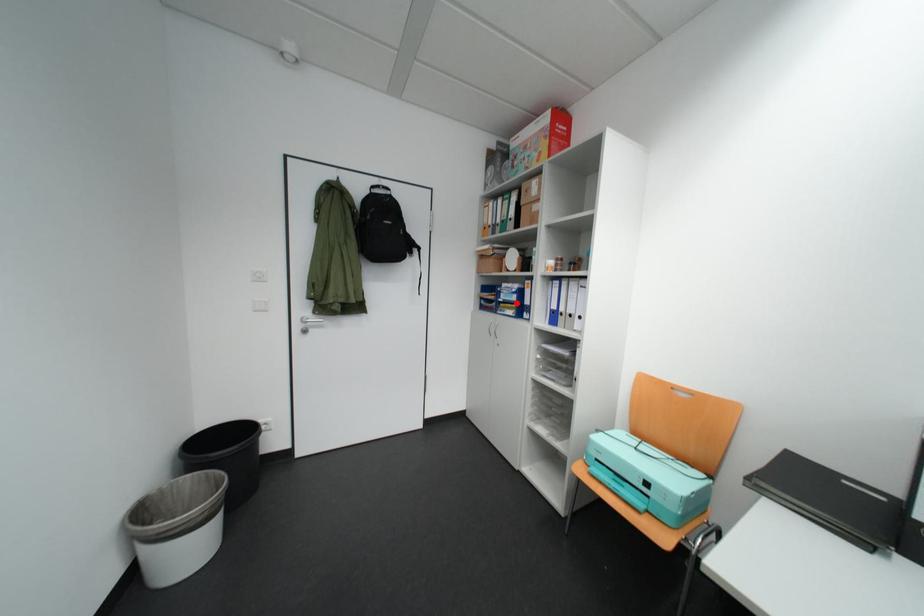
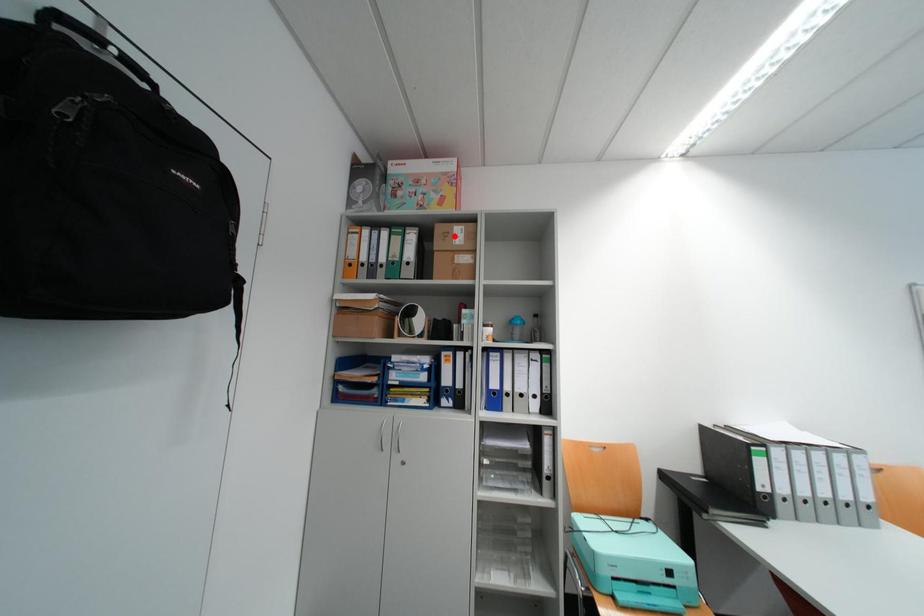
I am providing you with two images of the same scene from different viewpoints. A red point is marked on the first image and another point is marked on the second image. Does the point marked in image1 correspond to the same location as the one in image2?

No